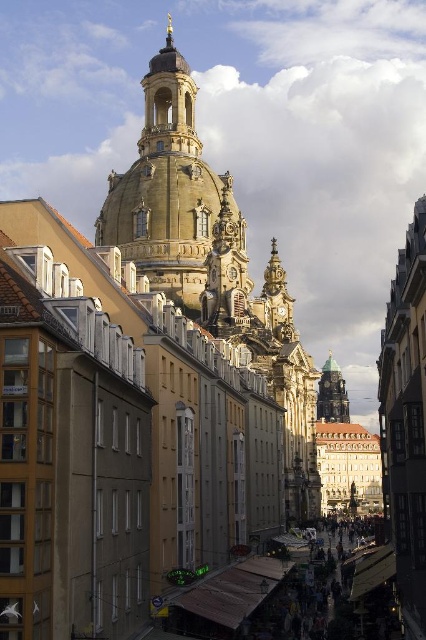
Question: Does golden stone tower at upper center have a larger size compared to gold textured dome at center?

Choices:
 (A) yes
 (B) no

Answer: (A)

Question: Can you confirm if golden stone tower at upper center is positioned below gold textured dome at center?

Choices:
 (A) no
 (B) yes

Answer: (A)

Question: Is golden stone tower at upper center bigger than gold textured dome at center?

Choices:
 (A) yes
 (B) no

Answer: (A)

Question: Which point is closer to the camera?

Choices:
 (A) (342, 406)
 (B) (176, 173)

Answer: (B)

Question: Which object is farther from the camera taking this photo?

Choices:
 (A) gold textured dome at center
 (B) golden stone tower at upper center

Answer: (A)

Question: Which point appears closest to the camera in this image?

Choices:
 (A) (190, 100)
 (B) (333, 396)

Answer: (A)